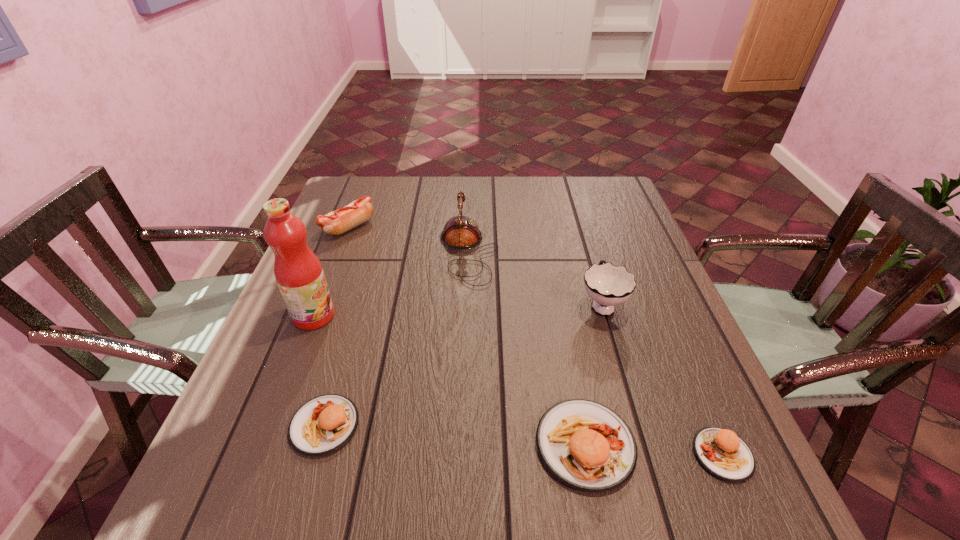
Find the location of a particular element. This screenshot has height=540, width=960. vacant space that satisfies the following two spatial constraints: 1. on the front label of the rightmost patty; 2. on the right side of the tallest object is located at coordinates (259, 455).

The image size is (960, 540). Identify the location of free space in the image that satisfies the following two spatial constraints: 1. on the front label of the tallest object; 2. on the left side of the second tallest patty. (271, 425).

Identify the location of free space in the image that satisfies the following two spatial constraints: 1. on the rotary dial of the sixth shortest object; 2. on the side of the cup with the handle. The width and height of the screenshot is (960, 540). tap(467, 303).

Where is `vacant space that satisfies the following two spatial constraints: 1. on the rotary dial of the fourth object from left to right; 2. on the right side of the shortest object`? vacant space that satisfies the following two spatial constraints: 1. on the rotary dial of the fourth object from left to right; 2. on the right side of the shortest object is located at coordinates [x=462, y=455].